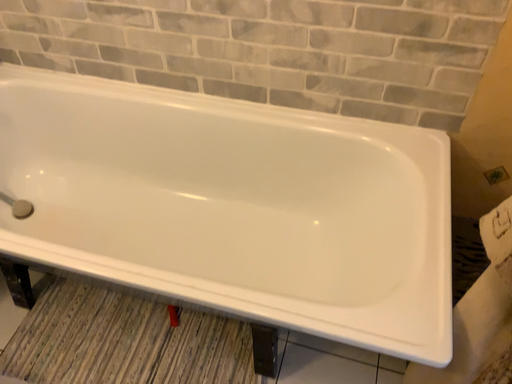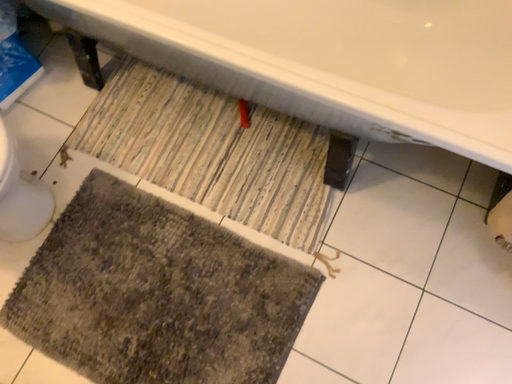
Question: How did the camera likely rotate when shooting the video?

Choices:
 (A) rotated upward
 (B) rotated downward

Answer: (B)